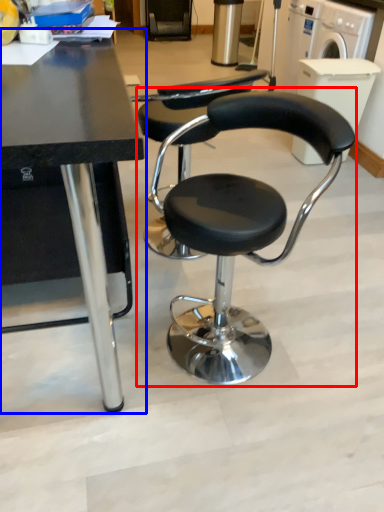
Question: Which point is further to the camera, chair (highlighted by a red box) or table (highlighted by a blue box)?

Choices:
 (A) chair
 (B) table

Answer: (A)